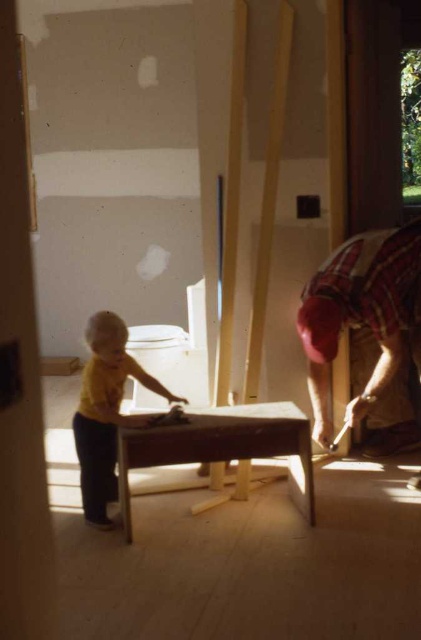
Question: Among these points, which one is farthest from the camera?

Choices:
 (A) (119, 452)
 (B) (324, 280)

Answer: (B)

Question: Where is plaid fabric shirt at right located in relation to smooth wooden table at center in the image?

Choices:
 (A) above
 (B) below

Answer: (A)

Question: Can you confirm if plaid fabric shirt at right is positioned to the right of yellow matte shirt at center?

Choices:
 (A) yes
 (B) no

Answer: (A)

Question: Estimate the real-world distances between objects in this image. Which object is farther from the plaid fabric shirt at right?

Choices:
 (A) yellow matte shirt at center
 (B) smooth wooden table at center

Answer: (A)

Question: Which of the following is the farthest from the observer?

Choices:
 (A) (365, 243)
 (B) (226, 416)

Answer: (B)

Question: Is smooth wooden table at center wider than yellow matte shirt at center?

Choices:
 (A) yes
 (B) no

Answer: (A)